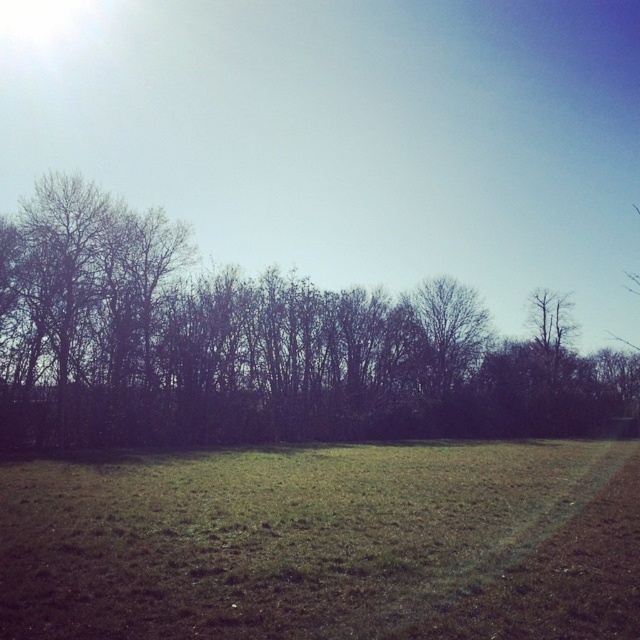
Question: Which point appears farthest from the camera in this image?

Choices:
 (A) (456, 604)
 (B) (124, 272)

Answer: (B)

Question: Among these points, which one is nearest to the camera?

Choices:
 (A) (547, 374)
 (B) (612, 496)

Answer: (B)

Question: From the image, what is the correct spatial relationship of green grass at center in relation to dark brown leafless trees at center?

Choices:
 (A) right
 (B) left

Answer: (B)

Question: Is green grass at center wider than dark brown leafless trees at center?

Choices:
 (A) no
 (B) yes

Answer: (A)

Question: Is green grass at center bigger than dark brown leafless trees at center?

Choices:
 (A) yes
 (B) no

Answer: (B)

Question: Among these objects, which one is nearest to the camera?

Choices:
 (A) green grass at center
 (B) dark brown leafless trees at center

Answer: (A)